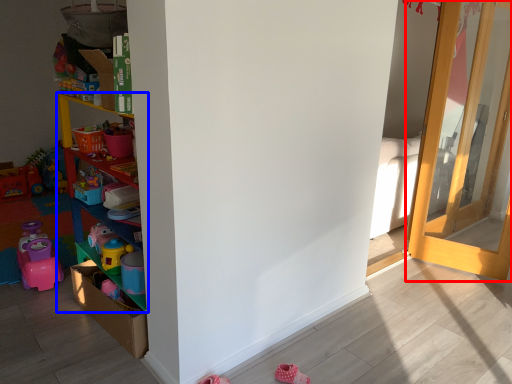
Question: Which object is closer to the camera taking this photo, door (highlighted by a red box) or shelf (highlighted by a blue box)?

Choices:
 (A) door
 (B) shelf

Answer: (B)